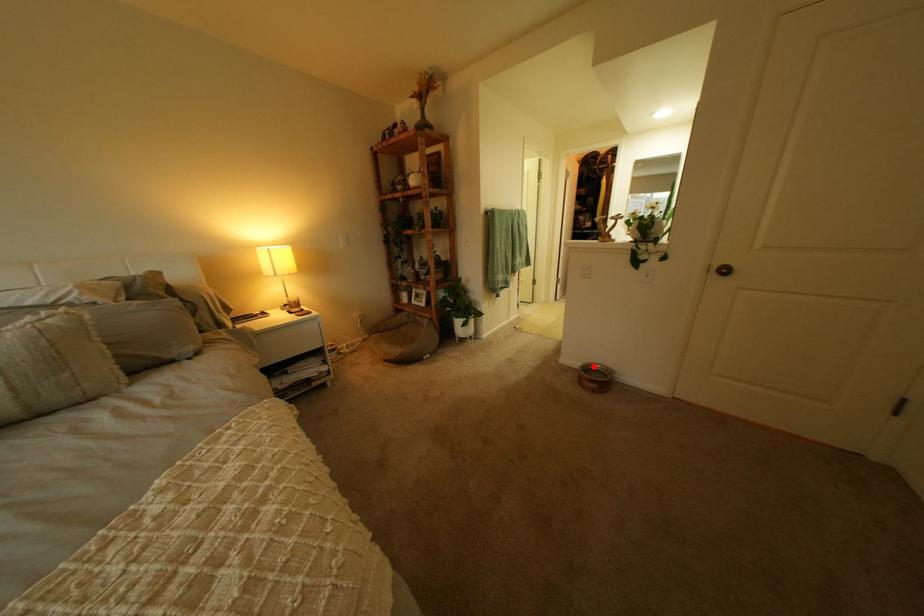
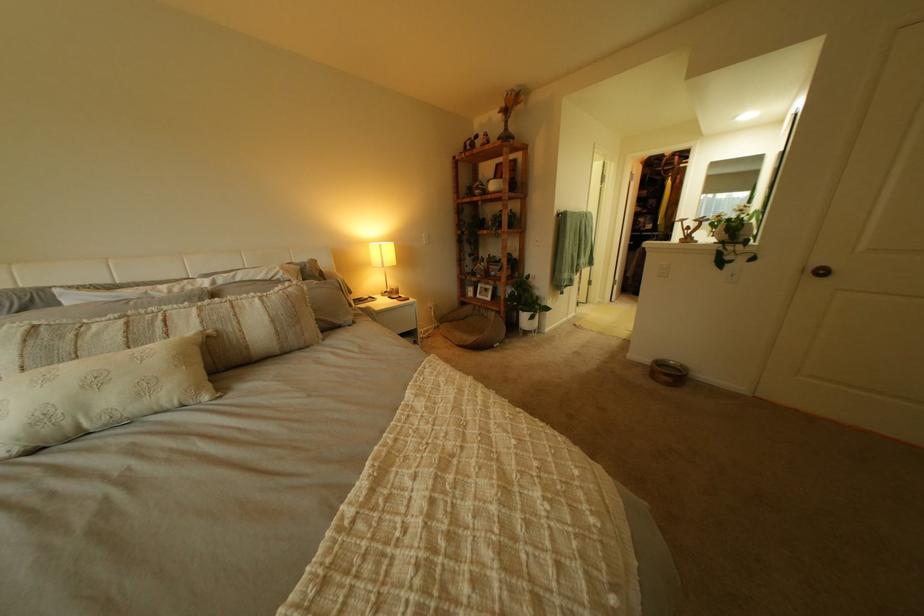
Where in the second image is the point corresponding to the highlighted location from the first image?

(663, 362)